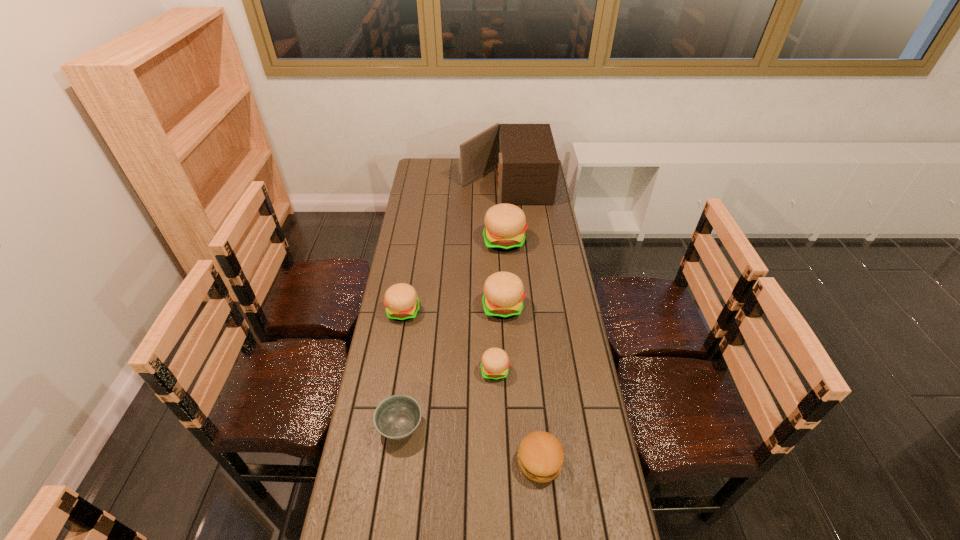
This screenshot has width=960, height=540. I want to click on beige hamburger that is the closest to the second tallest hamburger, so click(x=495, y=362).

Where is `blank area in the image that satisfies the following two spatial constraints: 1. with the door open on the front of the brown hamburger; 2. on the left side of the farthest object`? The width and height of the screenshot is (960, 540). blank area in the image that satisfies the following two spatial constraints: 1. with the door open on the front of the brown hamburger; 2. on the left side of the farthest object is located at coordinates (525, 461).

Where is `vacant space that satisfies the following two spatial constraints: 1. on the back side of the gray bowl; 2. on the right side of the fourth shortest hamburger`? vacant space that satisfies the following two spatial constraints: 1. on the back side of the gray bowl; 2. on the right side of the fourth shortest hamburger is located at coordinates (417, 307).

The width and height of the screenshot is (960, 540). Find the location of `free region that satisfies the following two spatial constraints: 1. on the back side of the third smallest beige hamburger; 2. on the left side of the gray bowl`. free region that satisfies the following two spatial constraints: 1. on the back side of the third smallest beige hamburger; 2. on the left side of the gray bowl is located at coordinates (417, 307).

Locate an element on the screen. The image size is (960, 540). free spot that satisfies the following two spatial constraints: 1. with the door open on the front of the tallest object; 2. on the front side of the nearest beige hamburger is located at coordinates (518, 370).

Where is `vacant space that satisfies the following two spatial constraints: 1. on the back side of the nearest hamburger; 2. with the door open on the front of the tallest object`? vacant space that satisfies the following two spatial constraints: 1. on the back side of the nearest hamburger; 2. with the door open on the front of the tallest object is located at coordinates (513, 183).